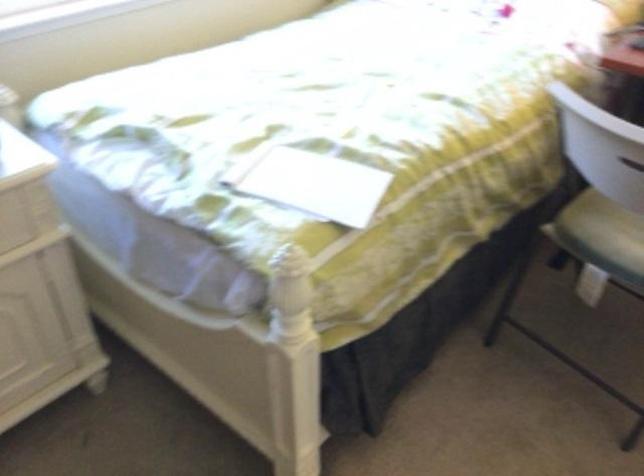
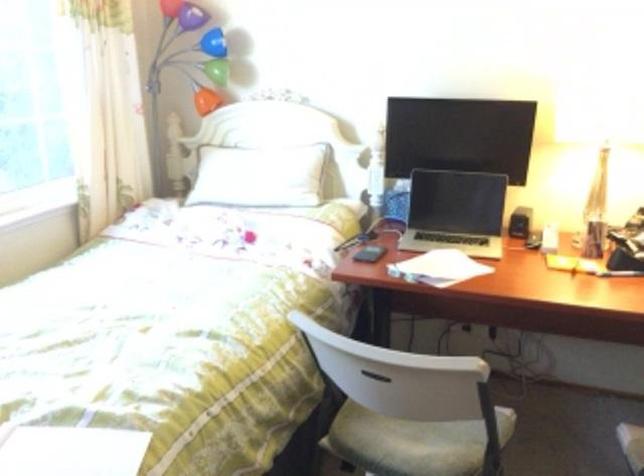
The images are taken continuously from a first-person perspective. In which direction are you moving?

The cameraman walked toward right, backward.